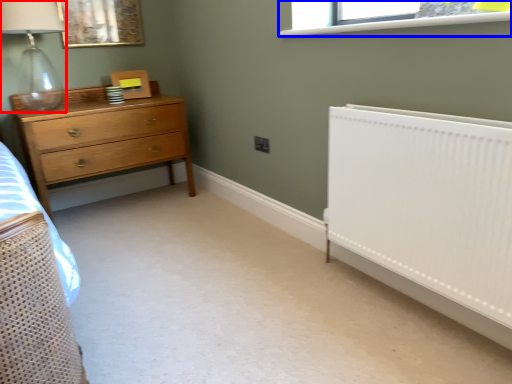
Question: Which object appears farthest to the camera in this image, lamp (highlighted by a red box) or window (highlighted by a blue box)?

Choices:
 (A) lamp
 (B) window

Answer: (A)